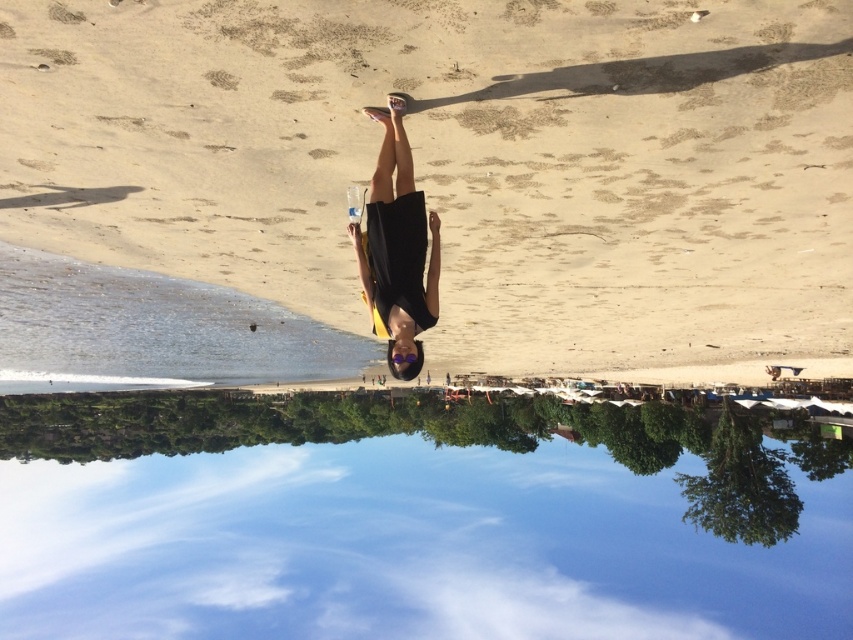
You are a photographer planning to take a photo of the transparent glass water at center and the black matte dress at center. Given that your camera has a maximum focus range of 50 meters, will you be able to capture both objects clearly in the same photo?

The transparent glass water at center and black matte dress at center are 78.83 meters apart. Since the camera can only focus up to 50 meters, capturing both clearly in the same photo is not possible due to the distance exceeding the focus range.

You are a photographer trying to capture the transparent glass water at center and the black matte dress at center in the same frame. Which object will appear larger in the photo if you focus on the one that is closer to the camera?

The transparent glass water at center will appear larger in the photo because it is taller than the black matte dress at center, so focusing on it would make it the dominant subject.

You are a photographer trying to capture the entire scene of the beige sand at center and the black matte dress at center in one shot. Based on their relative heights, which object will appear larger in the photo?

The beige sand at center will appear larger in the photo because it is much taller than the black matte dress at center.